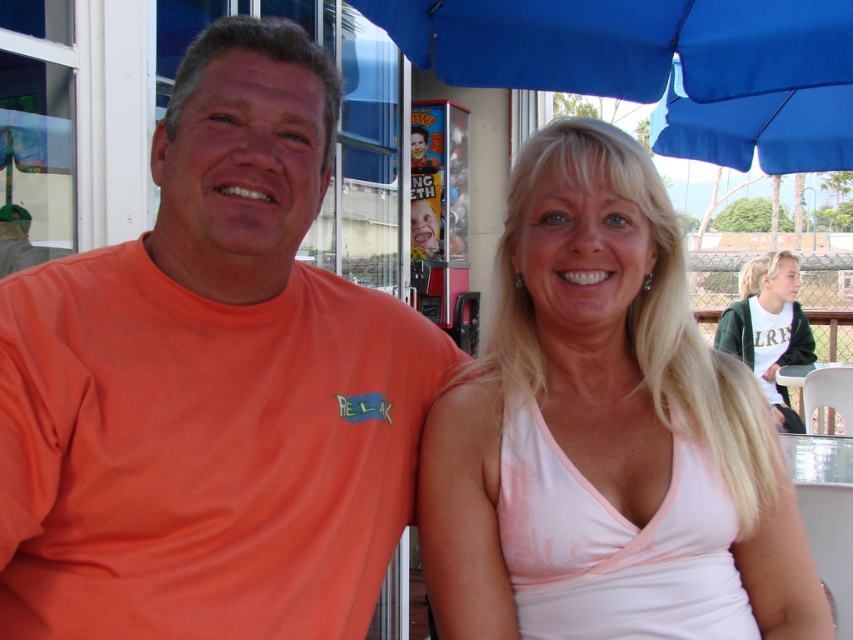
Question: Can you confirm if blue fabric umbrella at upper center is thinner than white cotton shirt at upper right?

Choices:
 (A) yes
 (B) no

Answer: (B)

Question: Can you confirm if pink satin tank top at upper right is thinner than blue fabric umbrella at upper center?

Choices:
 (A) no
 (B) yes

Answer: (B)

Question: Does orange t-shirt at left come in front of white cotton shirt at upper right?

Choices:
 (A) yes
 (B) no

Answer: (A)

Question: Which point is farther to the camera?

Choices:
 (A) blue fabric umbrella at upper center
 (B) pink satin tank top at upper right

Answer: (A)

Question: Which object is the farthest from the orange t-shirt at left?

Choices:
 (A) white cotton shirt at upper right
 (B) blue fabric umbrella at upper center

Answer: (A)

Question: Among these objects, which one is farthest from the camera?

Choices:
 (A) orange t-shirt at left
 (B) white cotton shirt at upper right
 (C) blue fabric umbrella at upper center

Answer: (B)